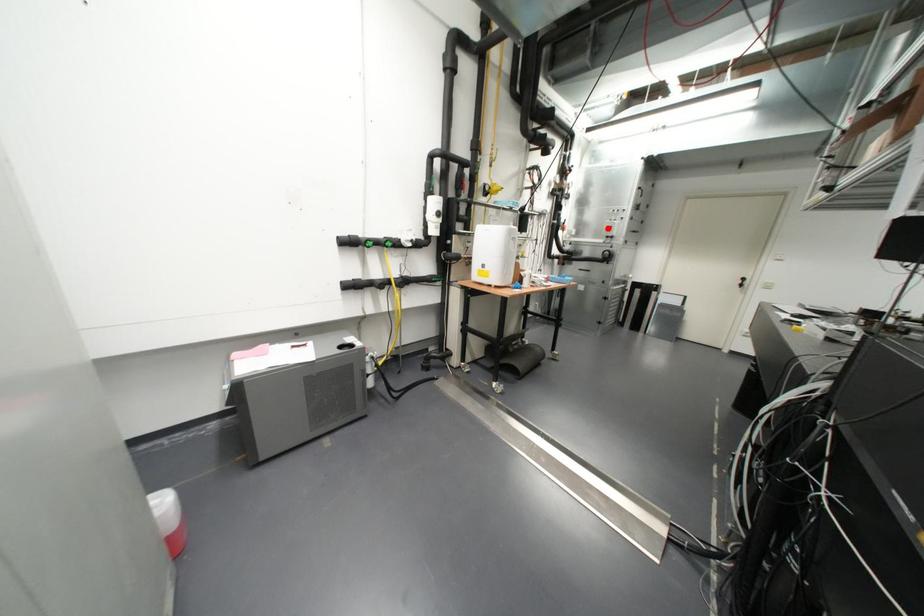
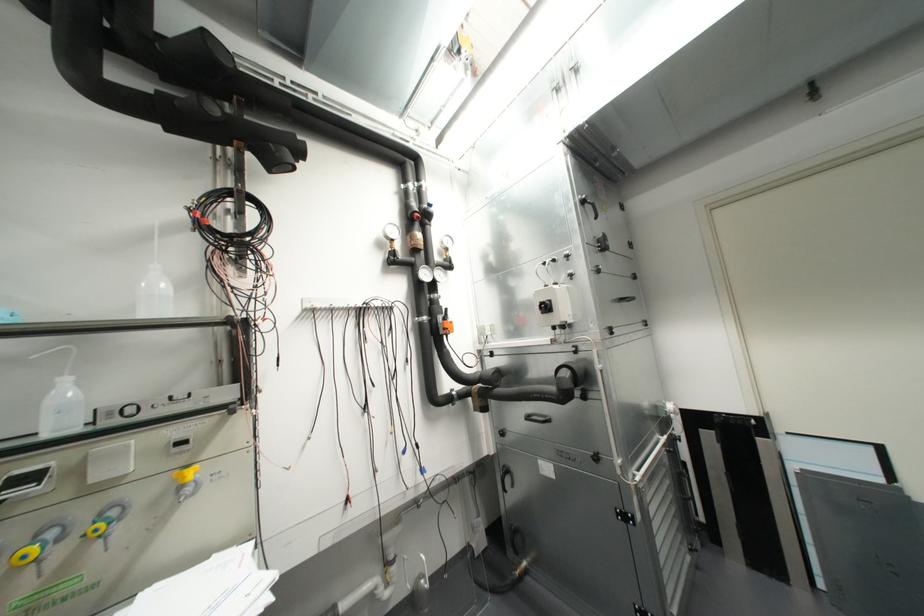
Find the pixel in the second image that matches the highlighted location in the first image.

(545, 307)